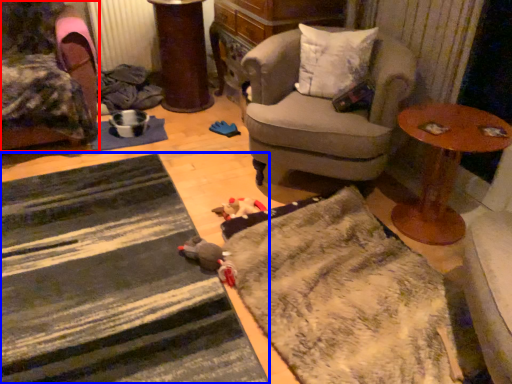
Question: Which of the following is the farthest to the observer, chair (highlighted by a red box) or doormat (highlighted by a blue box)?

Choices:
 (A) chair
 (B) doormat

Answer: (A)